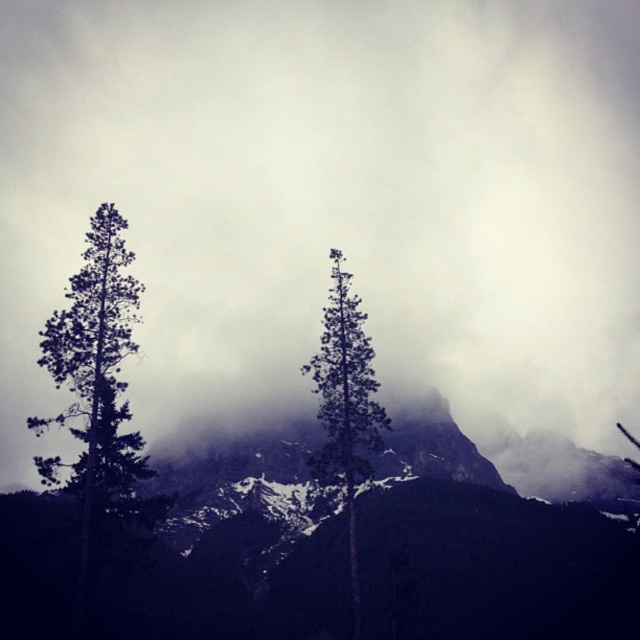
Question: Which point is closer to the camera?

Choices:
 (A) (294, 445)
 (B) (332, 355)

Answer: (B)

Question: Does smokey gray rock at center have a lesser width compared to green matte tree at center?

Choices:
 (A) yes
 (B) no

Answer: (B)

Question: Is dark green textured tree at left wider than green matte tree at center?

Choices:
 (A) no
 (B) yes

Answer: (B)

Question: Is smokey gray rock at center to the right of dark green textured tree at left from the viewer's perspective?

Choices:
 (A) yes
 (B) no

Answer: (A)

Question: Which is farther from the smokey gray rock at center?

Choices:
 (A) green matte tree at center
 (B) dark green textured tree at left

Answer: (B)

Question: Which object is farther from the camera taking this photo?

Choices:
 (A) smokey gray rock at center
 (B) dark green textured tree at left

Answer: (A)